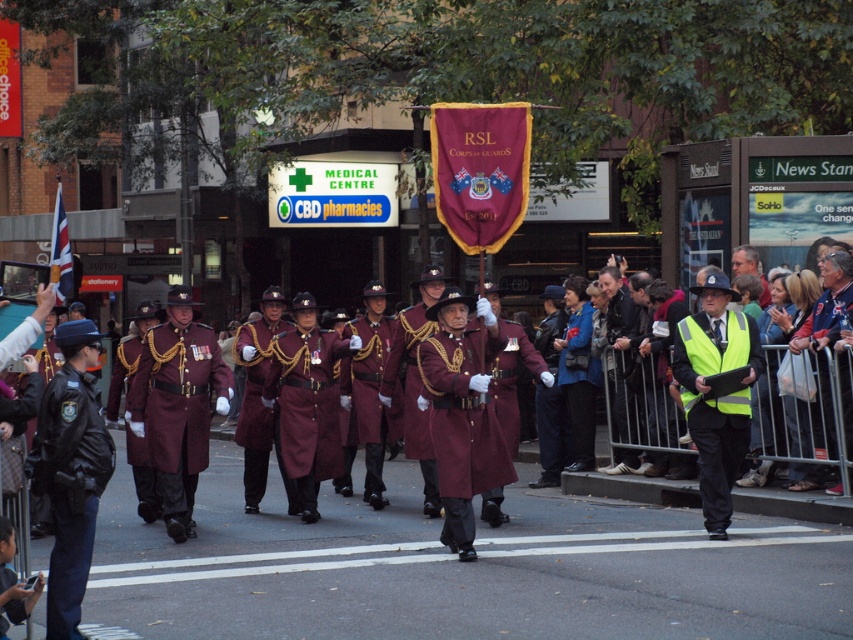
Question: Which of the following is the farthest from the observer?

Choices:
 (A) (616, 358)
 (B) (573, 620)

Answer: (A)

Question: Does maroon fabric uniform at center appear on the left side of leather jacket at right?

Choices:
 (A) yes
 (B) no

Answer: (A)

Question: Which point is closer to the camera?

Choices:
 (A) leather jacket at right
 (B) yellow reflective vest at center
 (C) black leather jacket at left
 (D) maroon uniform at center

Answer: (C)

Question: Does maroon woolen coat at center have a lesser width compared to maroon wool coat at center?

Choices:
 (A) yes
 (B) no

Answer: (B)

Question: Which point appears farthest from the camera in this image?

Choices:
 (A) (664, 568)
 (B) (727, 445)
 (C) (757, 268)

Answer: (C)

Question: Considering the relative positions of leather jacket at right and maroon uniform at center in the image provided, where is leather jacket at right located with respect to maroon uniform at center?

Choices:
 (A) left
 (B) right

Answer: (A)